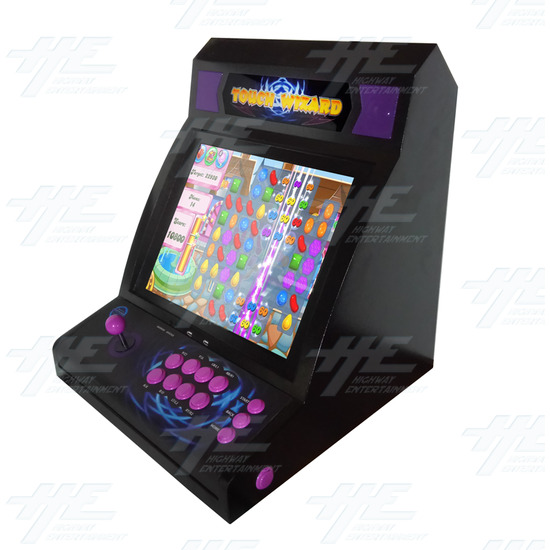
Locate an element on the screen. The width and height of the screenshot is (550, 550). corner is located at coordinates (232, 518), (428, 367), (58, 374), (213, 42), (433, 48), (455, 86), (411, 73), (396, 151), (192, 115), (195, 59).